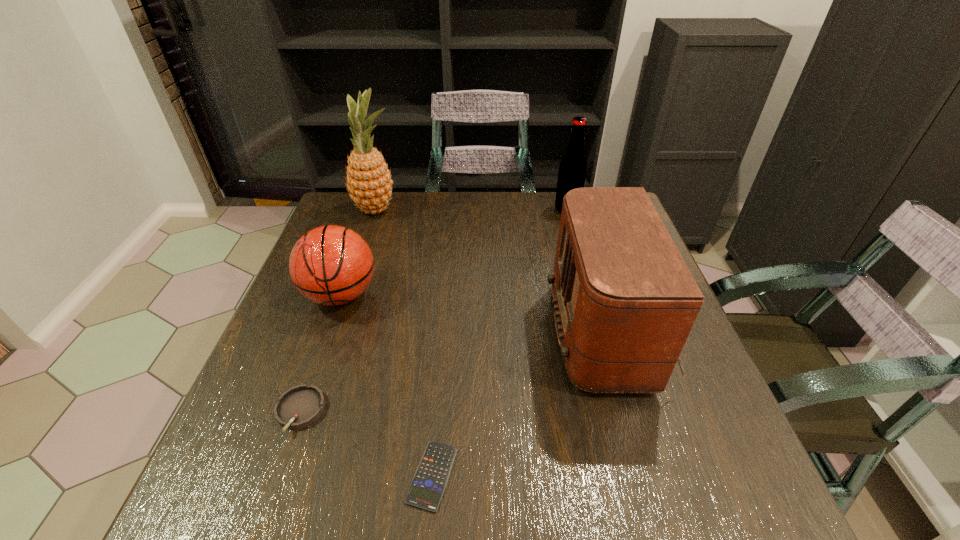
Where is `unoccupied area between the fourth tallest object and the beer bottle`? Image resolution: width=960 pixels, height=540 pixels. unoccupied area between the fourth tallest object and the beer bottle is located at coordinates (454, 252).

Identify the location of free space between the beer bottle and the tallest object. The image size is (960, 540). (471, 210).

You are a GUI agent. You are given a task and a screenshot of the screen. Output one action in this format:
    pyautogui.click(x=<x>, y=<y>)
    Task: Click on the unoccupied position between the fourth object from left to right and the radio receiver
    
    Given the screenshot: What is the action you would take?
    pyautogui.click(x=525, y=404)

The width and height of the screenshot is (960, 540). I want to click on empty location between the pineapple and the ashtray, so click(x=338, y=311).

The image size is (960, 540). Find the location of `free spot between the second shortest object and the radio receiver`. free spot between the second shortest object and the radio receiver is located at coordinates (459, 373).

Identify the location of vacant area that lies between the second shortest object and the radio receiver. (459, 373).

Where is `unoccupied area between the shortest object and the beer bottle`? The image size is (960, 540). unoccupied area between the shortest object and the beer bottle is located at coordinates (499, 343).

The height and width of the screenshot is (540, 960). What are the coordinates of `unoccupied area between the third shortest object and the radio receiver` in the screenshot? It's located at (480, 314).

At what (x,y) coordinates should I click in order to perform the action: click on blank region between the nearest object and the pineapple. Please return your answer as a coordinate pair (x, y). The height and width of the screenshot is (540, 960). Looking at the image, I should click on (404, 343).

Identify which object is the fifth closest to the beer bottle. Please provide its 2D coordinates. Your answer should be formatted as a tuple, i.e. [(x, y)], where the tuple contains the x and y coordinates of a point satisfying the conditions above.

[(300, 406)]